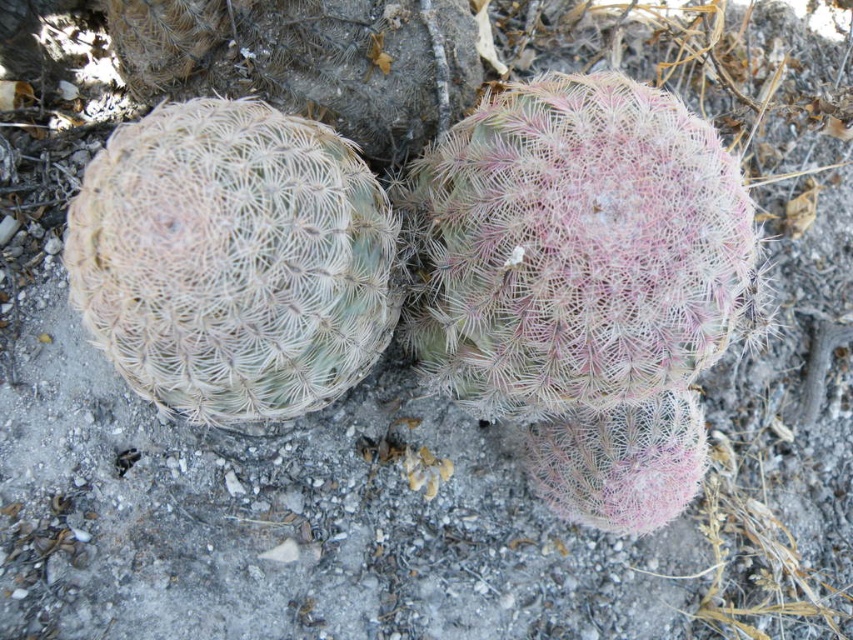
Looking at this image, you are standing at the origin point in the image and want to locate the pink spiky cactus at center. Which direction should you move to find it?

The pink spiky cactus at center is located at coordinates 0.444 on the x axis and 0.686 on the y axis. Since you are at the origin point, you should move right along the x axis to 0.444 and up along the y axis to 0.686 to reach it.

You are a desert explorer who needs to place a small flag between the pink spiky cactus at center and the white spiky cactus at left. Based on their positions, where should you place the flag to ensure it is between them?

The pink spiky cactus at center is to the right of the white spiky cactus at left, so you should place the flag to the right of the white spiky cactus at left and to the left of the pink spiky cactus at center to ensure it is between them.

You are a gardener trying to plant a new cactus between the pink spiky cactus at center and the white spiky cactus at left. Based on their heights, which cactus should you consider as the taller one to ensure proper spacing?

The pink spiky cactus at center is taller than the white spiky cactus at left, so you should consider the pink spiky cactus at center as the taller one for proper spacing.